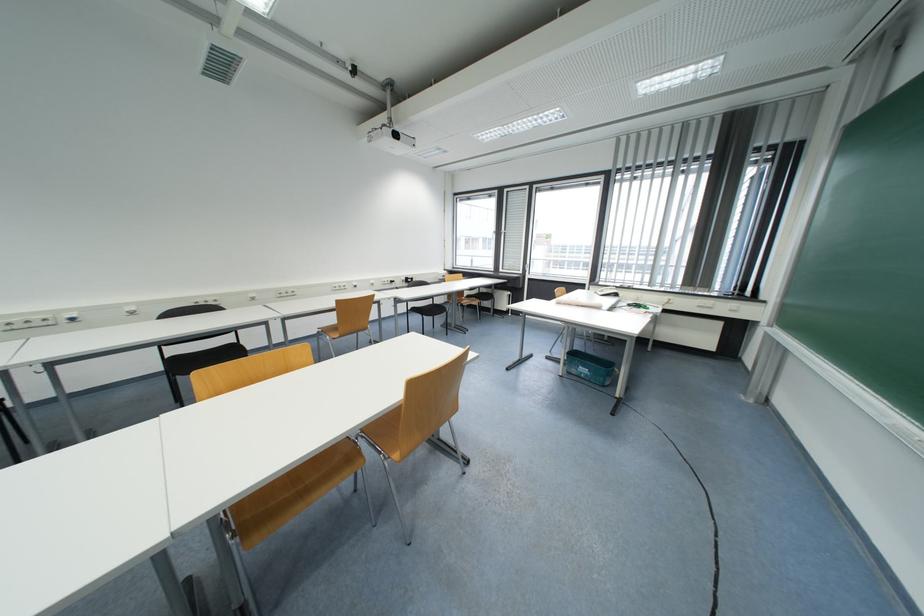
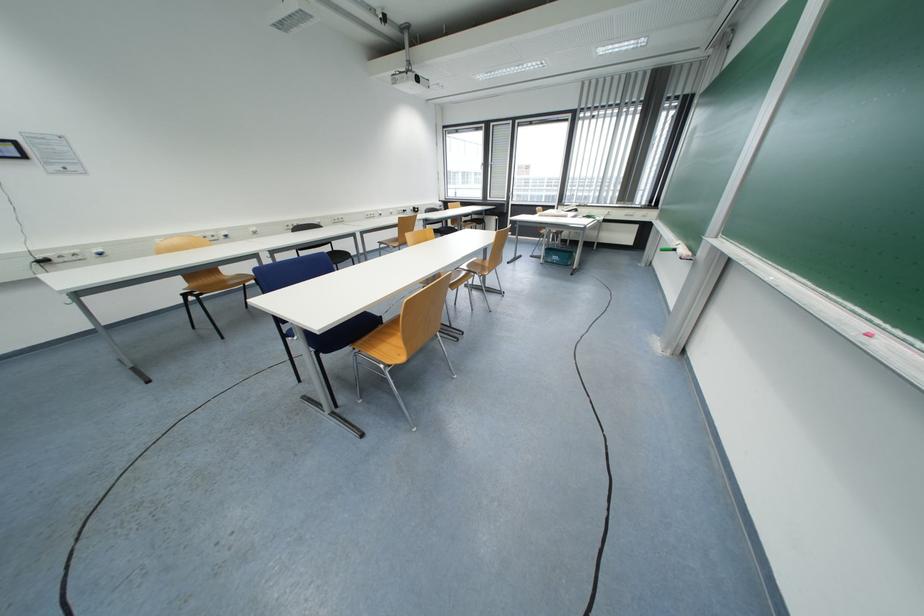
Locate, in the second image, the point that corresponds to the point at 233,341 in the first image.

(332, 251)